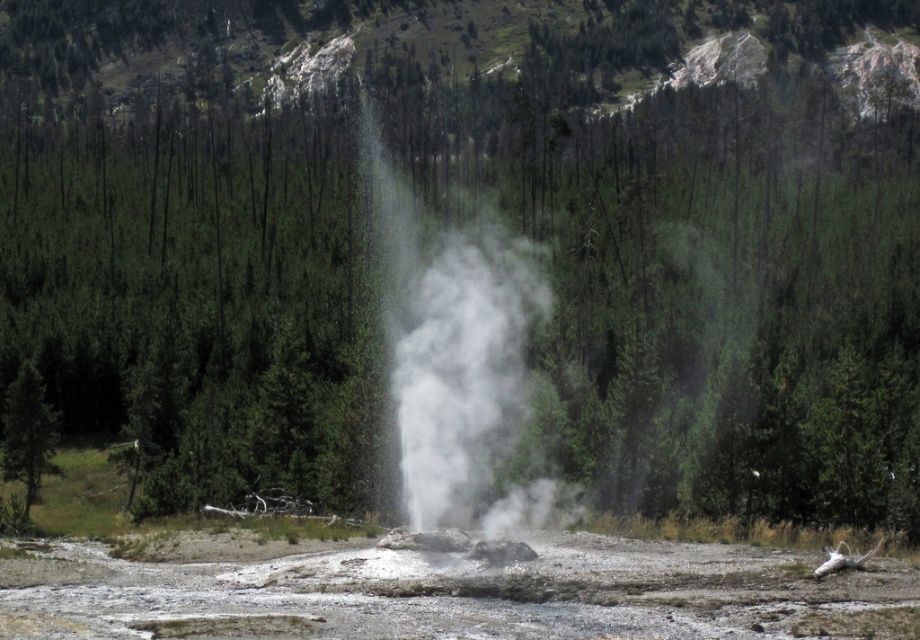
Question: Among these objects, which one is farthest from the camera?

Choices:
 (A) white vapor at center
 (B) green matte tree at left

Answer: (B)

Question: Can you confirm if white vapor at center is positioned to the right of green matte tree at left?

Choices:
 (A) yes
 (B) no

Answer: (A)

Question: Does white vapor at center appear over green matte tree at left?

Choices:
 (A) yes
 (B) no

Answer: (A)

Question: Can you confirm if white vapor at center is smaller than green matte tree at left?

Choices:
 (A) no
 (B) yes

Answer: (A)

Question: Which of the following is the closest to the observer?

Choices:
 (A) white vapor at center
 (B) green matte tree at left

Answer: (A)